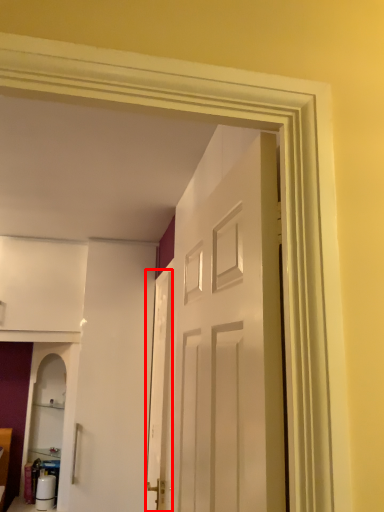
Question: From the image's perspective, where is screen door (annotated by the red box) located relative to door?

Choices:
 (A) below
 (B) above

Answer: (A)